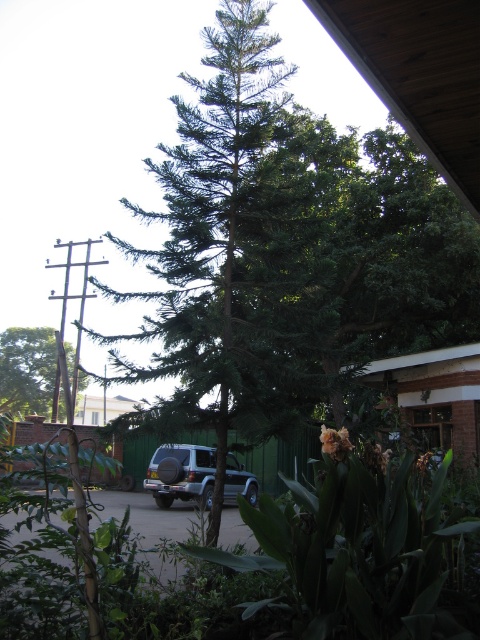
From the picture: Between gray metallic car at center and green matte tree at left, which one is positioned lower?

gray metallic car at center is below.

Does point (164, 529) come behind point (24, 388)?

No, it is in front of (24, 388).

The height and width of the screenshot is (640, 480). What are the coordinates of `gray metallic car at center` in the screenshot? It's located at (147, 516).

Is gray metallic car at center smaller than satin silver suv at center?

Actually, gray metallic car at center might be larger than satin silver suv at center.

Does gray metallic car at center appear over satin silver suv at center?

Incorrect, gray metallic car at center is not positioned above satin silver suv at center.

Which is in front, point (149, 561) or point (228, 497)?

Point (149, 561)

Identify the location of gray metallic car at center. Image resolution: width=480 pixels, height=640 pixels. (147, 516).

Can you confirm if green matte tree at left is smaller than satin silver suv at center?

No, green matte tree at left is not smaller than satin silver suv at center.

Can you confirm if green matte tree at left is bigger than satin silver suv at center?

Correct, green matte tree at left is larger in size than satin silver suv at center.

Between point (22, 365) and point (179, 470), which one is positioned behind?

Positioned behind is point (22, 365).

Identify the location of green matte tree at left. The width and height of the screenshot is (480, 640). (27, 369).